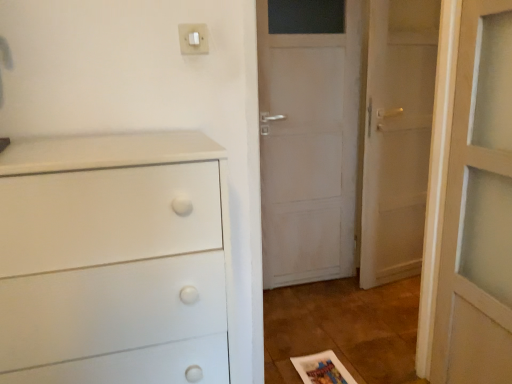
Question: Considering the positions of white matte chest of drawers at left and white plastic light switch at upper center in the image, is white matte chest of drawers at left bigger or smaller than white plastic light switch at upper center?

Choices:
 (A) big
 (B) small

Answer: (A)

Question: Would you say white matte chest of drawers at left is to the left or to the right of white plastic light switch at upper center in the picture?

Choices:
 (A) right
 (B) left

Answer: (B)

Question: Which object is the farthest from the white matte chest of drawers at left?

Choices:
 (A) white plastic light switch at upper center
 (B) white wooden door at right

Answer: (B)

Question: Which of these objects is positioned farthest from the white wooden door at right?

Choices:
 (A) white plastic light switch at upper center
 (B) white matte chest of drawers at left

Answer: (B)